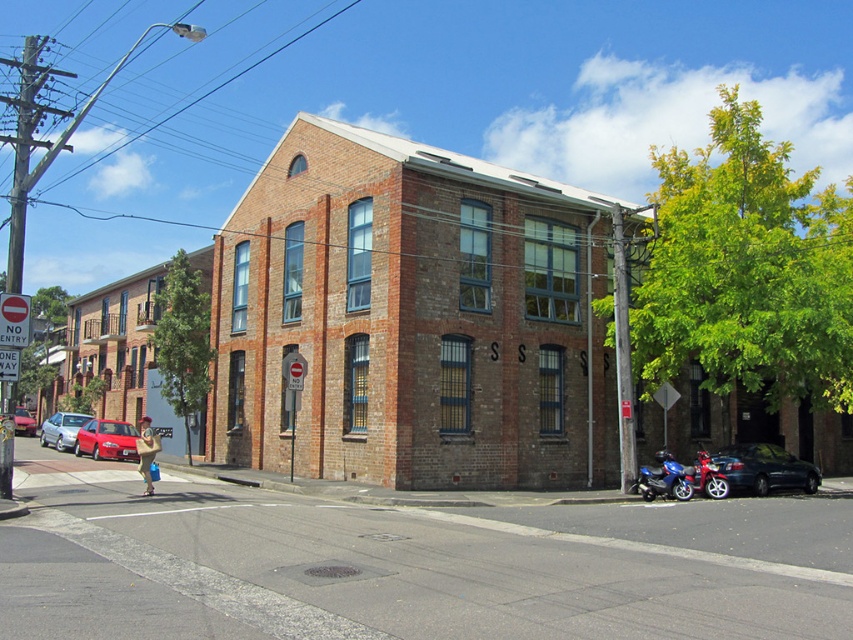
Question: Among these points, which one is farthest from the camera?

Choices:
 (A) (39, 440)
 (B) (657, 472)

Answer: (A)

Question: Does shiny black sedan at lower right have a greater width compared to blue metallic motorcycle at lower right?

Choices:
 (A) yes
 (B) no

Answer: (A)

Question: Which of the following is the closest to the observer?

Choices:
 (A) (367, 513)
 (B) (662, 477)

Answer: (A)

Question: Which point is closer to the camera taking this photo?

Choices:
 (A) (91, 456)
 (B) (51, 442)

Answer: (A)

Question: Is blue metallic motorcycle at lower right smaller than matte red car at center?

Choices:
 (A) no
 (B) yes

Answer: (B)

Question: From the image, what is the correct spatial relationship of brick building at center in relation to matte red car at center?

Choices:
 (A) below
 (B) above

Answer: (B)